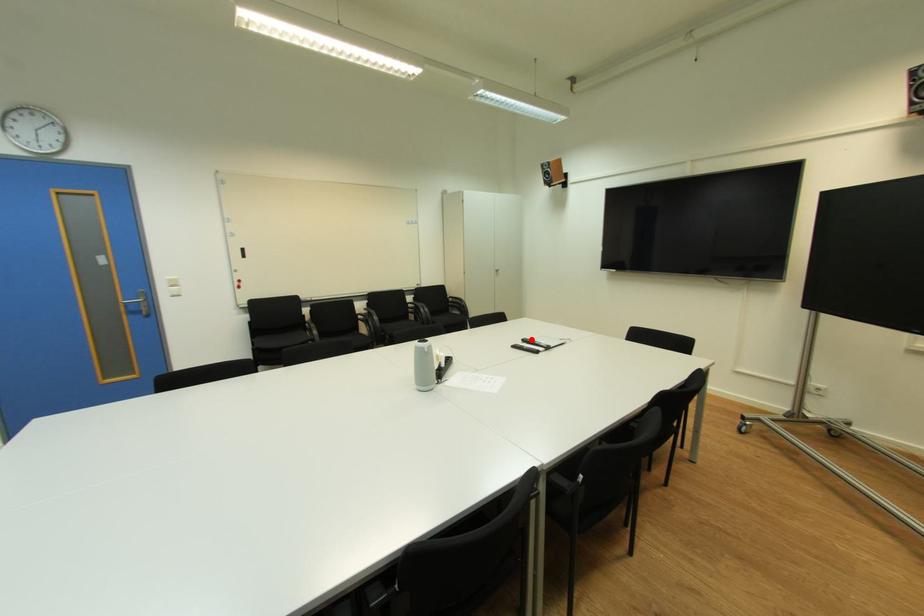
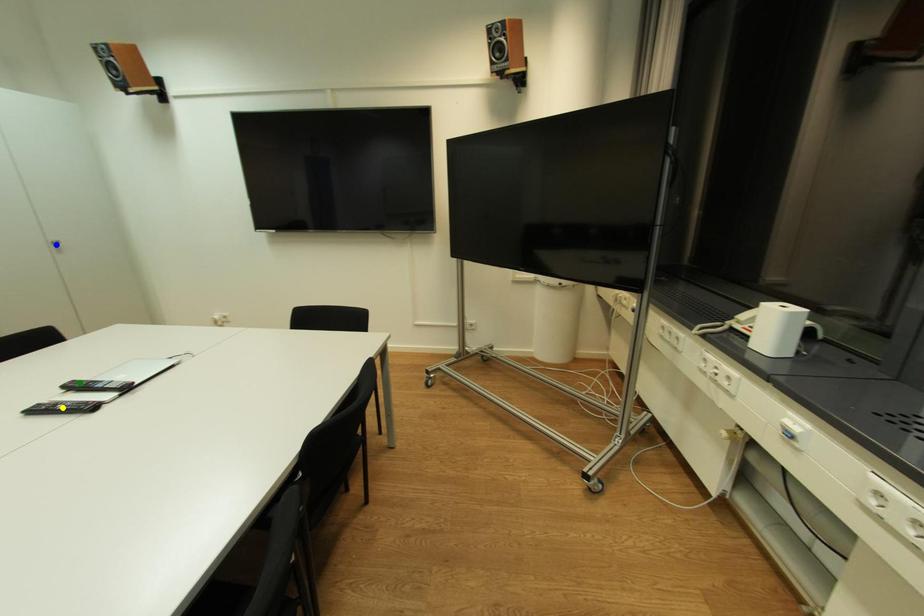
Question: I am providing you with two images of the same scene from different viewpoints. A red point is marked on the first image. You are given multiple points on the second image. In image 2, which mark is for the same physical point as the one in image 1?

Choices:
 (A) blue point
 (B) green point
 (C) yellow point

Answer: (B)